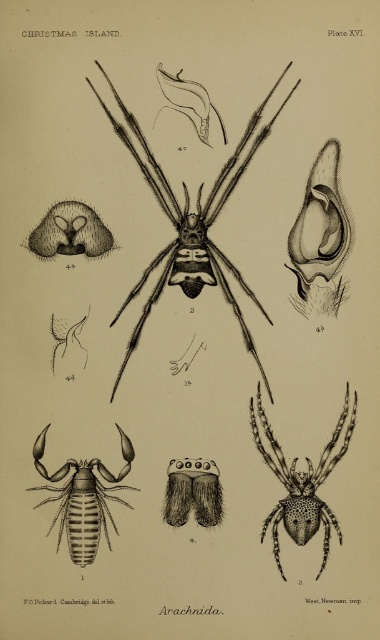
Can you confirm if black dotted spider at center is wider than brown fuzzy spider at center?

Indeed, black dotted spider at center has a greater width compared to brown fuzzy spider at center.

Measure the distance from black dotted spider at center to brown fuzzy spider at center.

A distance of 5.37 inches exists between black dotted spider at center and brown fuzzy spider at center.

The width and height of the screenshot is (380, 640). Describe the element at coordinates (302, 483) in the screenshot. I see `black dotted spider at center` at that location.

Find the location of a particular element. This screenshot has height=640, width=380. black dotted spider at center is located at coordinates (302, 483).

Who is taller, brown striped scorpion at lower left or brown fuzzy spider at center?

With more height is brown striped scorpion at lower left.

Who is more distant from viewer, (88, 518) or (180, 464)?

Point (180, 464)

I want to click on brown striped scorpion at lower left, so click(82, 499).

Is black dotted spider at center to the left of brown striped scorpion at lower left from the viewer's perspective?

Incorrect, black dotted spider at center is not on the left side of brown striped scorpion at lower left.

Can you confirm if black dotted spider at center is taller than brown striped scorpion at lower left?

Correct, black dotted spider at center is much taller as brown striped scorpion at lower left.

Does point (270, 515) come behind point (44, 500)?

Yes, point (270, 515) is behind point (44, 500).

Locate an element on the screen. black dotted spider at center is located at coordinates (302, 483).